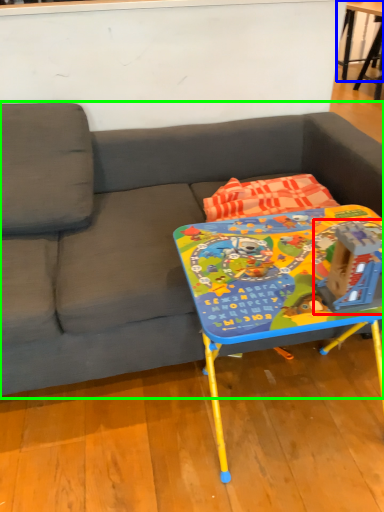
Question: Which object is positioned farthest from toy (highlighted by a red box)? Select from table (highlighted by a blue box) and studio couch (highlighted by a green box).

Choices:
 (A) table
 (B) studio couch

Answer: (A)